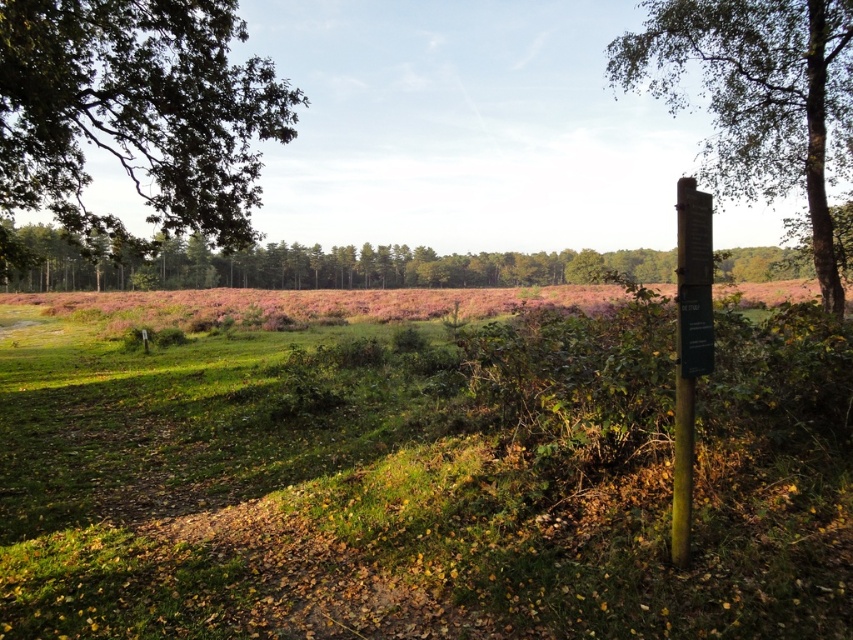
Question: Can you confirm if green leafy tree at upper left is positioned to the right of green wood signpost at right?

Choices:
 (A) no
 (B) yes

Answer: (A)

Question: Which of the following is the closest to the observer?

Choices:
 (A) green grass at center
 (B) wooden signpost at right
 (C) green wood signpost at right
 (D) green leafy tree at upper left

Answer: (A)

Question: Estimate the real-world distances between objects in this image. Which object is closer to the green leafy tree at left?

Choices:
 (A) wooden signpost at right
 (B) green wood signpost at right
 (C) green leafy tree at upper left
 (D) green grass at center

Answer: (C)

Question: Can you confirm if green wood signpost at right is smaller than wooden signpost at right?

Choices:
 (A) yes
 (B) no

Answer: (B)

Question: Which of these objects is positioned closest to the green leafy tree at left?

Choices:
 (A) wooden signpost at right
 (B) green leafy tree at upper left
 (C) green leafy tree at right
 (D) green wood signpost at right

Answer: (B)

Question: Does green leafy tree at right lie behind wooden signpost at right?

Choices:
 (A) no
 (B) yes

Answer: (B)